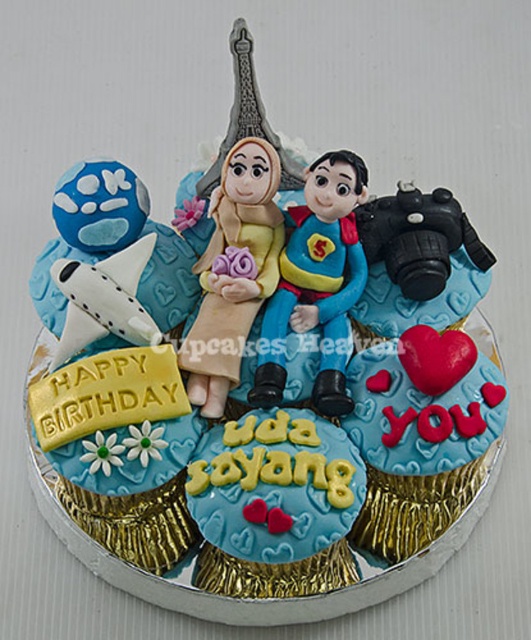
You are planning to place a birthday gift card on the cake. The gift card is 10 cm wide. Where should you place it so it doesn not cover any part of the matte plastic couple at center?

Since the matte plastic couple at center is located at point coordinates, you should place the gift card in an area that doesn not overlap with those coordinates. For example, placing it near the edge of the cake base where there are golden foil cupcakes or around the words uda sayang in yellow icing would ensure it doesn not cover the couple.

You are planning to place a small candle on the birthday cake. The matte yellow fabric doll at center and the matte blue airplane at left are both on the cake. How far apart are they?

The matte yellow fabric doll at center is 3.47 inches from the matte blue airplane at left.